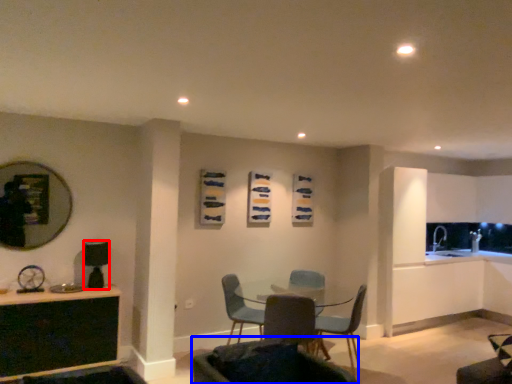
Question: Which of the following is the closest to the observer, appliance (highlighted by a red box) or chair (highlighted by a blue box)?

Choices:
 (A) appliance
 (B) chair

Answer: (B)